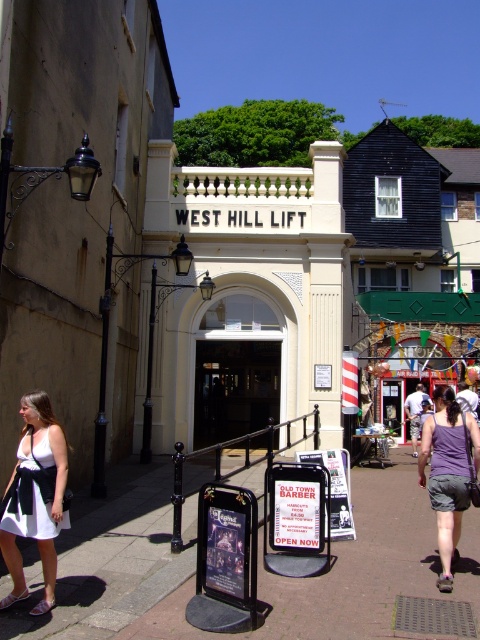
You are standing at the entrance of the West Hill Lift and want to take a photo that includes both the cream colored archway and the black lamppost. However, you notice two points marked on the ground at coordinates point (87, 566) and point (440, 403). Which point should you stand closer to in order to ensure both the archway and the lamppost are fully visible in your photo?

You should stand closer to point (87, 566) because it is closer to the viewer, allowing you to frame both the cream colored archway and the black lamppost within the camera view more effectively.

You are a delivery person trying to enter the West Hill Lift. You see a transparent glass door at center and a white plastic sign at center. Which one is wider?

The transparent glass door at center is wider than the white plastic sign at center.

Based on the scene description, what object is located at the coordinates point (235, 388)?

The transparent glass door at center is located at point (235, 388).